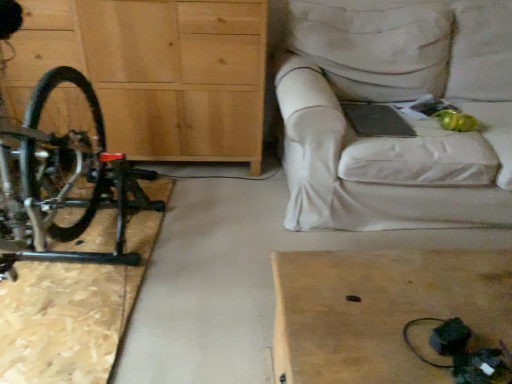
Question: Is wooden chest of drawers at left taller or shorter than white fabric couch at upper right?

Choices:
 (A) short
 (B) tall

Answer: (B)

Question: Is wooden chest of drawers at left bigger or smaller than white fabric couch at upper right?

Choices:
 (A) small
 (B) big

Answer: (A)

Question: Which object is the farthest from the black matte bicycle at left?

Choices:
 (A) wooden chest of drawers at left
 (B) light brown wooden table at lower right
 (C) white fabric couch at upper right

Answer: (C)

Question: Based on their relative distances, which object is farther from the white fabric couch at upper right?

Choices:
 (A) wooden chest of drawers at left
 (B) black matte bicycle at left
 (C) light brown wooden table at lower right

Answer: (B)